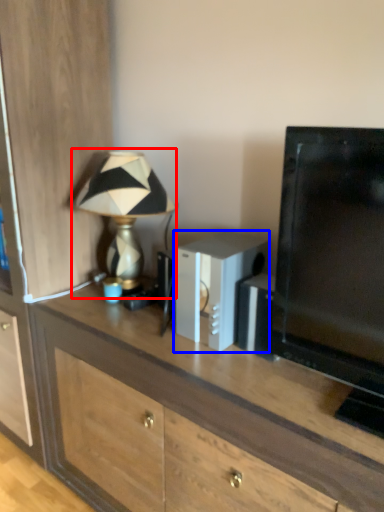
Question: Which object is closer to the camera taking this photo, lamp (highlighted by a red box) or appliance (highlighted by a blue box)?

Choices:
 (A) lamp
 (B) appliance

Answer: (B)